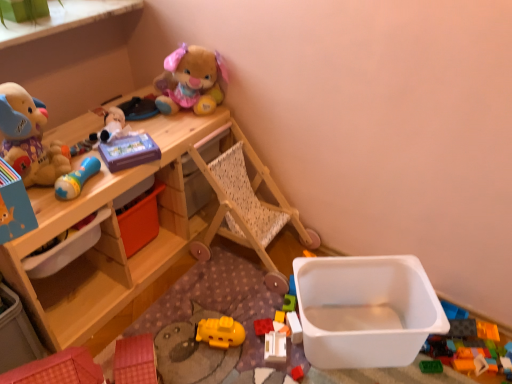
Locate an element on the screen. free point behind white plastic toy at center, the 1th toy from the bottom is located at coordinates (260, 311).